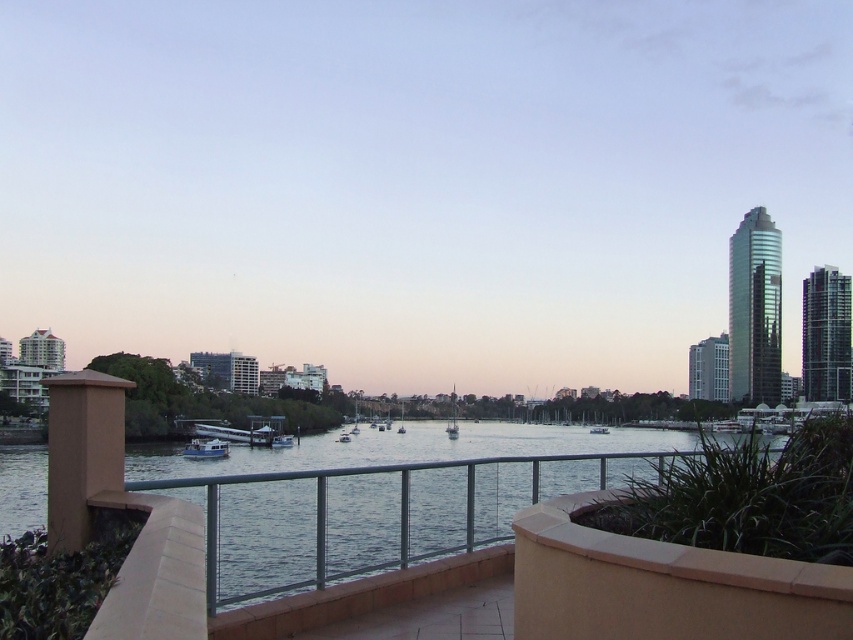
You are standing on the balcony and see both the metallic blue boat at center and the white glossy boat at center. Which boat is closer to the railing?

The metallic blue boat at center is closer to the railing because it is positioned over the white glossy boat at center, indicating it is nearer to the observer on the balcony.

You are standing on the balcony overlooking the river. You notice two points marked on the image. The first point is at coordinate point(503, 504) and the second is at point(192, 445). From your vantage point on the balcony, which point is closer to you?

Point(503, 504) is in front of point(192, 445), so it is closer to you.

You are standing on the balcony and want to observe the metallic blue boat at center. Can you see the clear water at center from your current position?

The clear water at center is positioned under the metallic blue boat at center, so it is obscured by the boat and cannot be seen from the balcony.